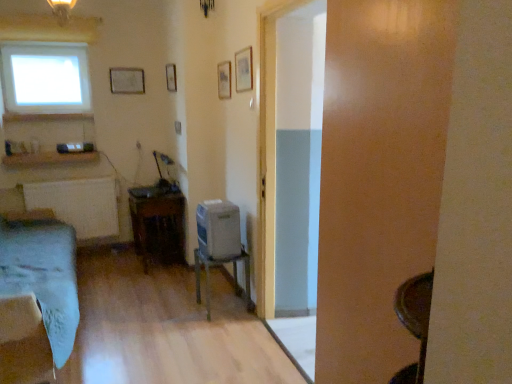
Question: Which is correct: white matte radiator at left is inside satin silver desktop at center, or outside of it?

Choices:
 (A) inside
 (B) outside

Answer: (B)

Question: From the image's perspective, is white matte radiator at left above or below satin silver desktop at center?

Choices:
 (A) below
 (B) above

Answer: (B)

Question: Which object is the closest to the wooden picture frame at upper center, which is the 4th picture frame from left to right?

Choices:
 (A) light blue fabric bed at left
 (B) matte white picture frame at upper center, the first picture frame when ordered from left to right
 (C) transparent glass window at upper left
 (D) satin silver desktop at center
 (E) transparent glass door at center

Answer: (E)

Question: Which is farther from the wooden picture frame at upper center, which ranks as the second picture frame in left-to-right order?

Choices:
 (A) matte white picture frame at upper center, positioned as the first picture frame in back-to-front order
 (B) satin silver desktop at center
 (C) transparent glass window at upper left
 (D) white matte radiator at left
 (E) light blue fabric bed at left

Answer: (E)